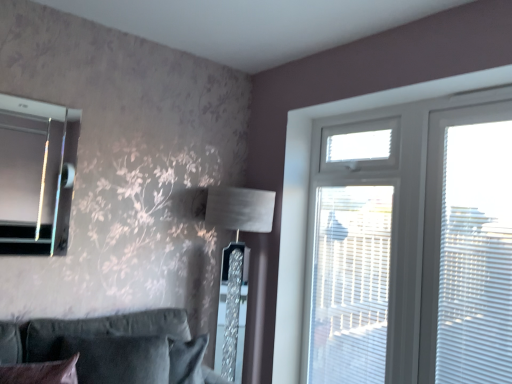
Question: Should I look upward or downward to see white plastic screen door at upper right?

Choices:
 (A) up
 (B) down

Answer: (B)

Question: Is white plastic blinds at right closer to camera compared to velvet dark brown pillow at lower left?

Choices:
 (A) no
 (B) yes

Answer: (A)

Question: Does white plastic blinds at right turn towards velvet dark brown pillow at lower left?

Choices:
 (A) no
 (B) yes

Answer: (A)

Question: From a real-world perspective, is white plastic blinds at right on velvet dark brown pillow at lower left?

Choices:
 (A) no
 (B) yes

Answer: (B)

Question: Can we say white plastic blinds at right lies outside velvet dark brown pillow at lower left?

Choices:
 (A) yes
 (B) no

Answer: (A)

Question: Can you confirm if white plastic blinds at right is taller than velvet dark brown pillow at lower left?

Choices:
 (A) yes
 (B) no

Answer: (A)

Question: Is white plastic blinds at right far away from velvet dark brown pillow at lower left?

Choices:
 (A) no
 (B) yes

Answer: (B)

Question: Considering the relative sizes of velvet dark brown pillow at lower left and white plastic blinds at right in the image provided, is velvet dark brown pillow at lower left thinner than white plastic blinds at right?

Choices:
 (A) yes
 (B) no

Answer: (B)

Question: Would you say velvet dark brown pillow at lower left is a long distance from white plastic blinds at right?

Choices:
 (A) yes
 (B) no

Answer: (A)

Question: Considering the relative positions of velvet dark brown pillow at lower left and white plastic blinds at right in the image provided, is velvet dark brown pillow at lower left behind white plastic blinds at right?

Choices:
 (A) yes
 (B) no

Answer: (B)

Question: Is the surface of velvet dark brown pillow at lower left in direct contact with white plastic blinds at right?

Choices:
 (A) yes
 (B) no

Answer: (B)

Question: Can you confirm if velvet dark brown pillow at lower left is bigger than white plastic blinds at right?

Choices:
 (A) yes
 (B) no

Answer: (B)

Question: Could you tell me if velvet dark brown pillow at lower left is facing white plastic blinds at right?

Choices:
 (A) no
 (B) yes

Answer: (A)

Question: From a real-world perspective, is white plastic window at upper right located higher than white plastic screen door at upper right?

Choices:
 (A) no
 (B) yes

Answer: (B)